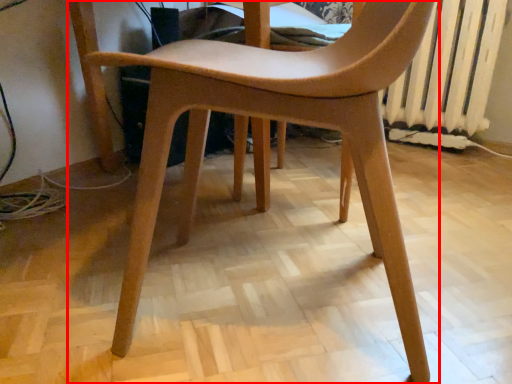
Question: From the image's perspective, where is chair (annotated by the red box) located in relation to radiator in the image?

Choices:
 (A) above
 (B) below

Answer: (B)